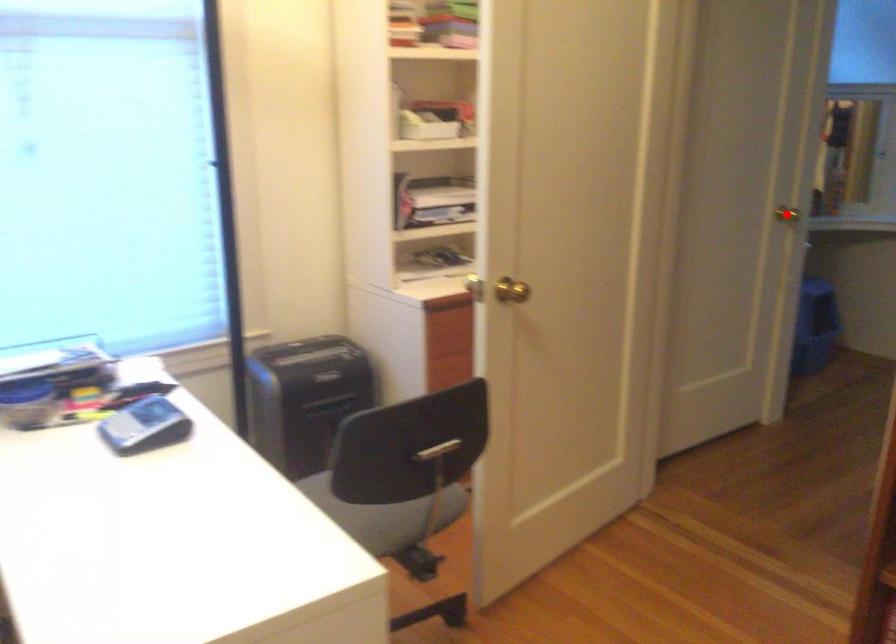
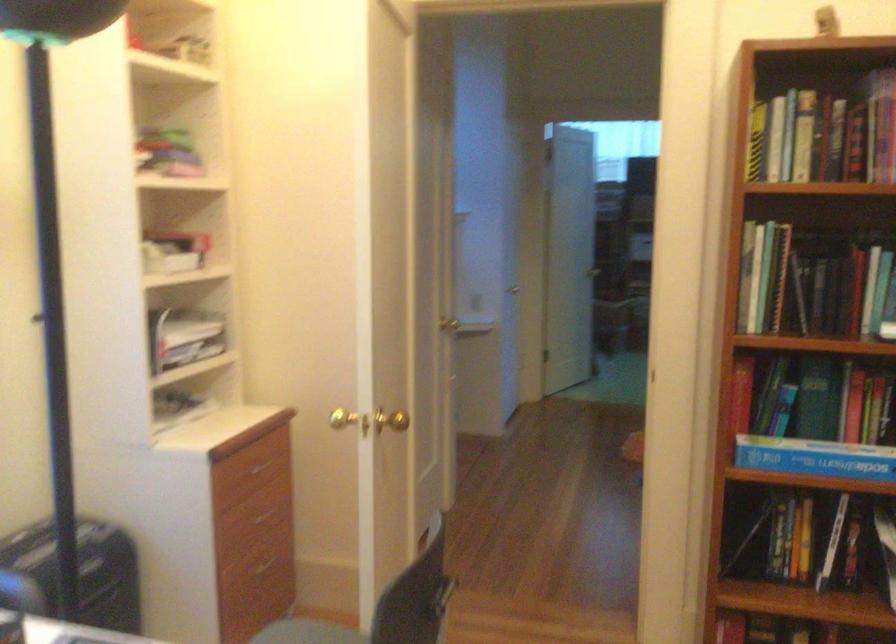
Question: I am providing you with two images of the same scene from different viewpoints. Given a red point in image1, look at the same physical point in image2. Is it:

Choices:
 (A) Closer to the viewpoint
 (B) Farther from the viewpoint

Answer: (B)